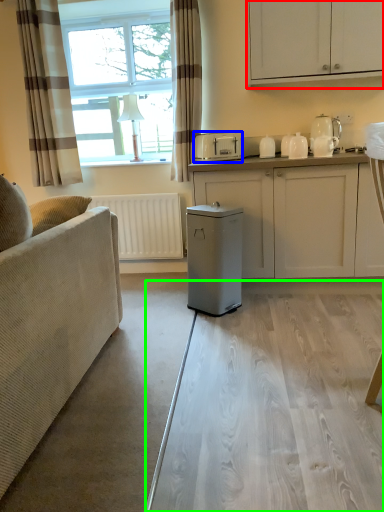
Question: Based on their relative distances, which object is farther from cabinetry (highlighted by a red box)? Choose from appliance (highlighted by a blue box) and glass table (highlighted by a green box).

Choices:
 (A) appliance
 (B) glass table

Answer: (B)